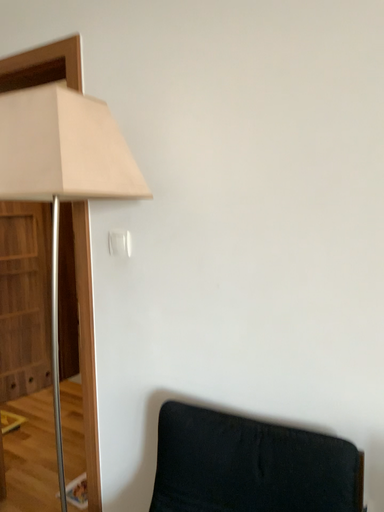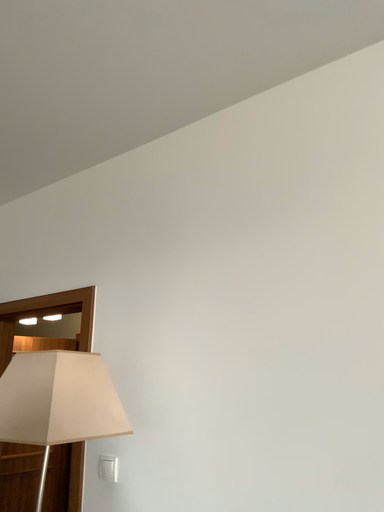
Question: How did the camera likely rotate when shooting the video?

Choices:
 (A) rotated upward
 (B) rotated downward

Answer: (A)